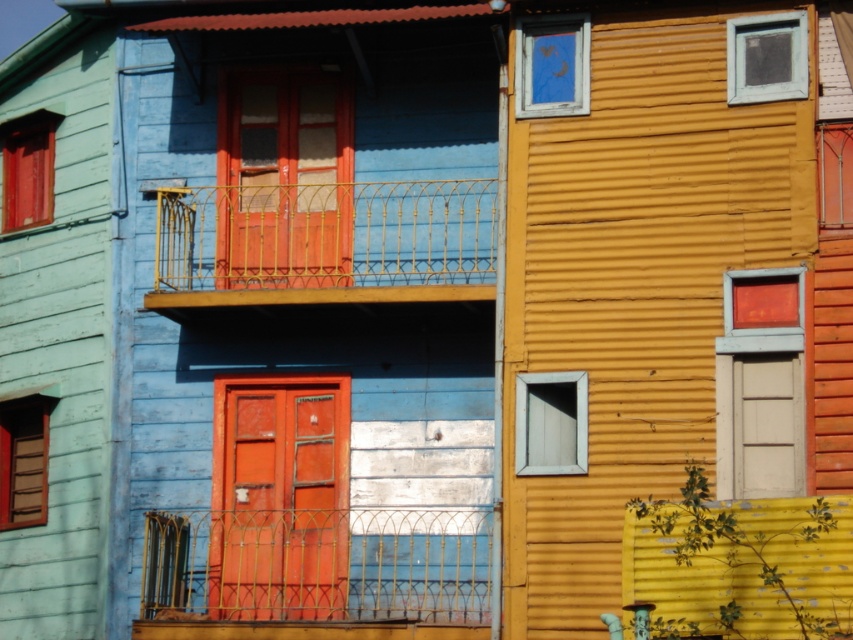
Question: Can you confirm if gold wrought iron balcony at center is wider than smooth wooden door at center?

Choices:
 (A) no
 (B) yes

Answer: (B)

Question: Observing the image, what is the correct spatial positioning of smooth wooden door at center in reference to white matte door at center?

Choices:
 (A) above
 (B) below

Answer: (B)

Question: Which point appears farthest from the camera in this image?

Choices:
 (A) (317, 250)
 (B) (740, 486)

Answer: (A)

Question: Where is smooth wooden door at center located in relation to white matte door at center in the image?

Choices:
 (A) left
 (B) right

Answer: (A)

Question: Based on their relative distances, which object is farther from the smooth wooden door at center?

Choices:
 (A) white matte door at center
 (B) gold wrought iron balcony at center

Answer: (A)

Question: Which is farther from the smooth wooden door at center?

Choices:
 (A) gold wrought iron balcony at center
 (B) white matte door at center

Answer: (B)